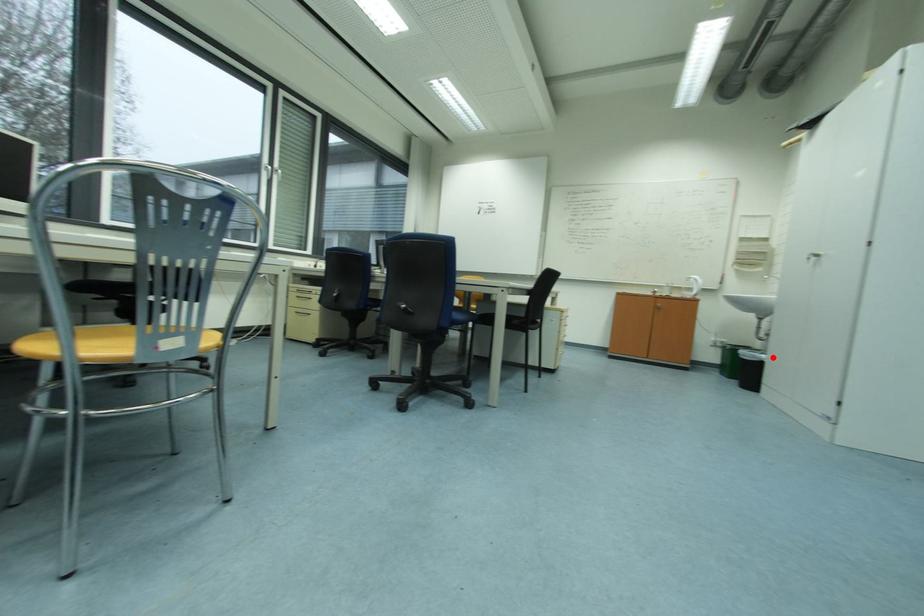
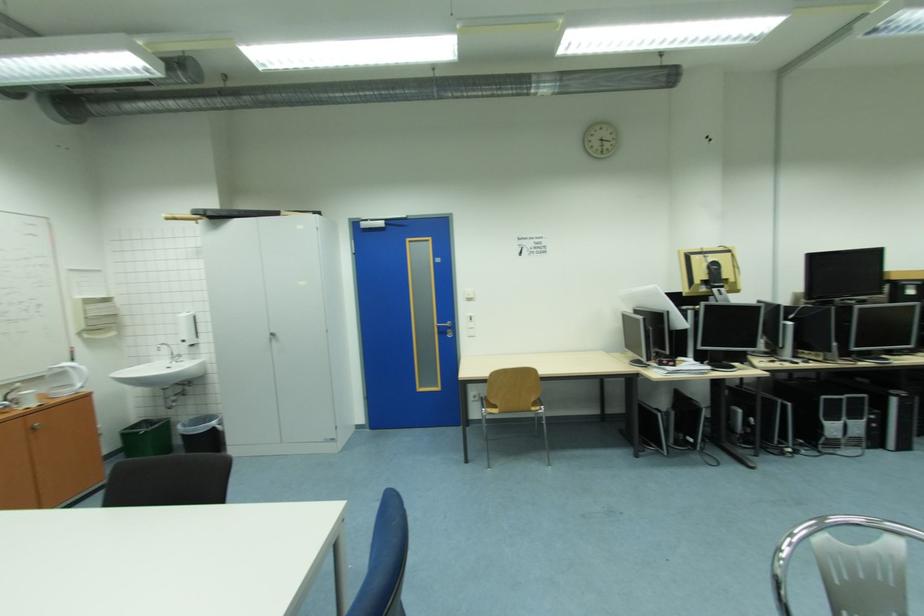
Question: I am providing you with two images of the same scene from different viewpoints. Given a red point in image1, look at the same physical point in image2. Is it:

Choices:
 (A) Closer to the viewpoint
 (B) Farther from the viewpoint

Answer: (A)